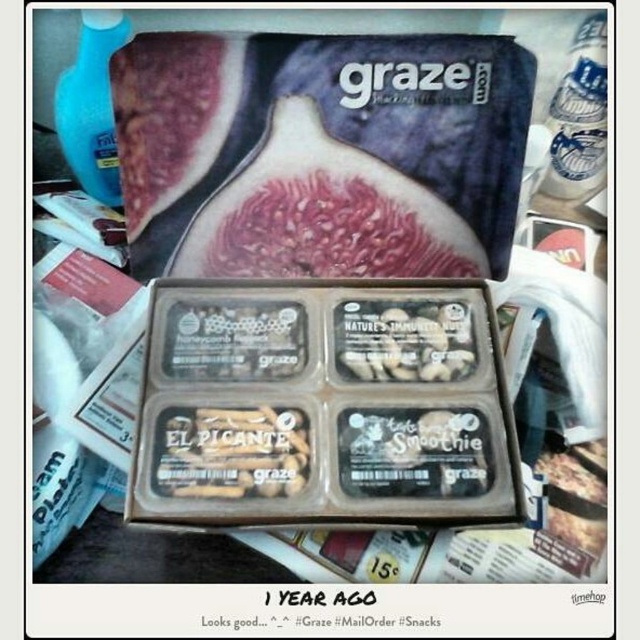
Question: Which point is closer to the camera?

Choices:
 (A) white matte nuts at center
 (B) brown matte snack bar at center
 (C) fuzzy red fig at center

Answer: (B)

Question: Can you confirm if fuzzy red fig at center is thinner than brown matte snack bar at center?

Choices:
 (A) yes
 (B) no

Answer: (B)

Question: Can you confirm if brown matte snack bar at center is positioned to the right of white matte nuts at center?

Choices:
 (A) yes
 (B) no

Answer: (B)

Question: Is fuzzy red fig at center to the right of brown matte snack bar at center from the viewer's perspective?

Choices:
 (A) no
 (B) yes

Answer: (B)

Question: Which of these objects is positioned closest to the white matte nuts at center?

Choices:
 (A) fuzzy red fig at center
 (B) brown matte snack bar at center

Answer: (A)

Question: Which point is farther to the camera?

Choices:
 (A) white matte nuts at center
 (B) brown matte snack bar at center

Answer: (A)